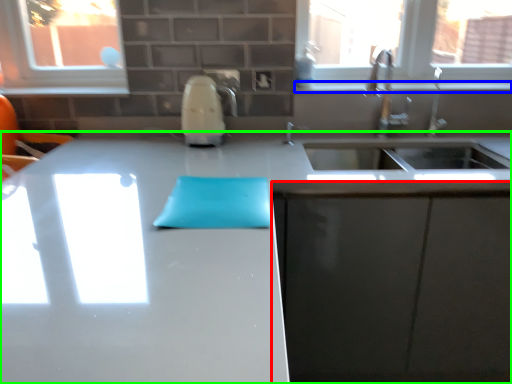
Question: Which is nearer to the cabinetry (highlighted by a red box)? window sill (highlighted by a blue box) or countertop (highlighted by a green box).

Choices:
 (A) window sill
 (B) countertop

Answer: (B)